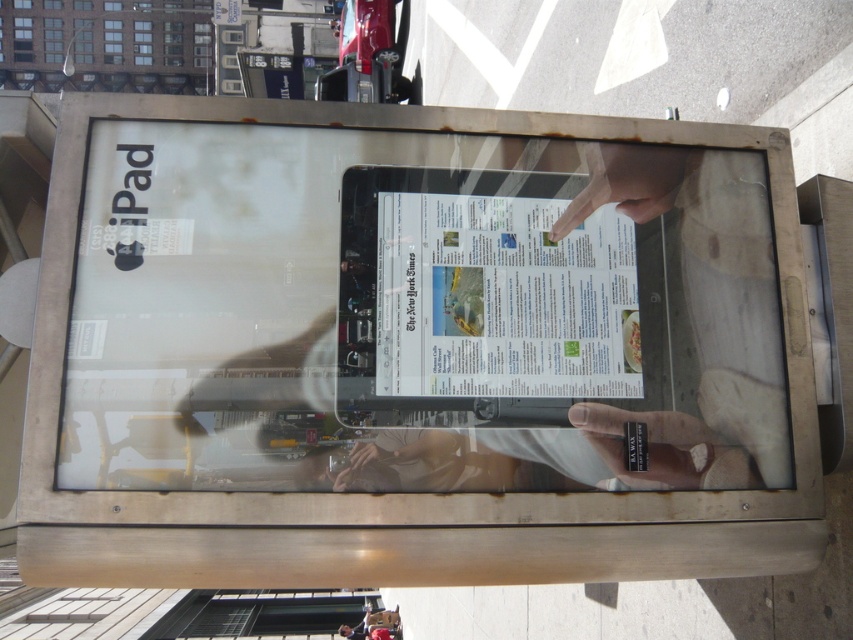
Can you confirm if smooth skin hand at lower center is shorter than matte black ring at center?

Yes, smooth skin hand at lower center is shorter than matte black ring at center.

Where is `smooth skin hand at lower center`? This screenshot has height=640, width=853. smooth skin hand at lower center is located at coordinates (563, 452).

Which is behind, point (630, 438) or point (689, 419)?

Positioned behind is point (689, 419).

You are a GUI agent. You are given a task and a screenshot of the screen. Output one action in this format:
    pyautogui.click(x=<x>, y=<y>)
    Task: Click on the smooth skin hand at lower center
    
    Given the screenshot: What is the action you would take?
    pyautogui.click(x=563, y=452)

Can you confirm if silver metallic tablet at center is smaller than matte black ring at center?

No, silver metallic tablet at center is not smaller than matte black ring at center.

Is silver metallic tablet at center shorter than matte black ring at center?

In fact, silver metallic tablet at center may be taller than matte black ring at center.

At what (x,y) coordinates should I click in order to perform the action: click on silver metallic tablet at center. Please return your answer as a coordinate pair (x, y). This screenshot has height=640, width=853. Looking at the image, I should click on (410, 307).

Locate an element on the screen. silver metallic tablet at center is located at coordinates (410, 307).

What do you see at coordinates (651, 444) in the screenshot? I see `matte black ring at center` at bounding box center [651, 444].

The height and width of the screenshot is (640, 853). Identify the location of matte black ring at center. (651, 444).